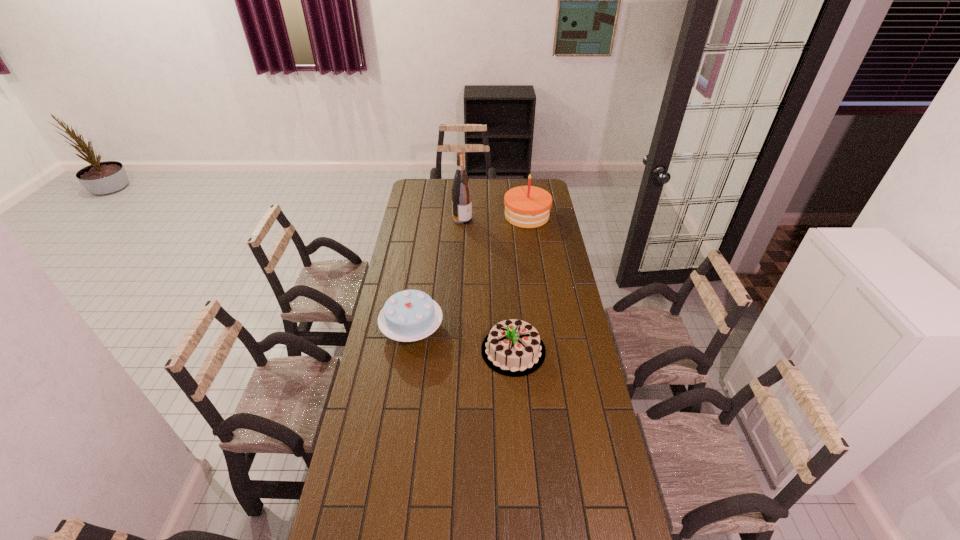
Where is `free spot between the second tallest object and the third object from right to left`? Image resolution: width=960 pixels, height=540 pixels. free spot between the second tallest object and the third object from right to left is located at coordinates (494, 218).

Identify which object is located as the third nearest to the leftmost birthday cake. Please provide its 2D coordinates. Your answer should be formatted as a tuple, i.e. [(x, y)], where the tuple contains the x and y coordinates of a point satisfying the conditions above.

[(528, 206)]

At what (x,y) coordinates should I click in order to perform the action: click on object that stands as the third closest to the tallest birthday cake. Please return your answer as a coordinate pair (x, y). The width and height of the screenshot is (960, 540). Looking at the image, I should click on click(x=513, y=348).

You are a GUI agent. You are given a task and a screenshot of the screen. Output one action in this format:
    pyautogui.click(x=<x>, y=<y>)
    Task: Click on the third closest birthday cake relative to the third object from right to left
    
    Given the screenshot: What is the action you would take?
    pyautogui.click(x=513, y=348)

Point out which birthday cake is positioned as the second nearest to the farthest birthday cake. Please provide its 2D coordinates. Your answer should be formatted as a tuple, i.e. [(x, y)], where the tuple contains the x and y coordinates of a point satisfying the conditions above.

[(513, 348)]

At what (x,y) coordinates should I click in order to perform the action: click on vacant point that satisfies the following two spatial constraints: 1. on the back side of the wine bottle; 2. on the right side of the leftmost birthday cake. Please return your answer as a coordinate pair (x, y). Looking at the image, I should click on point(429,219).